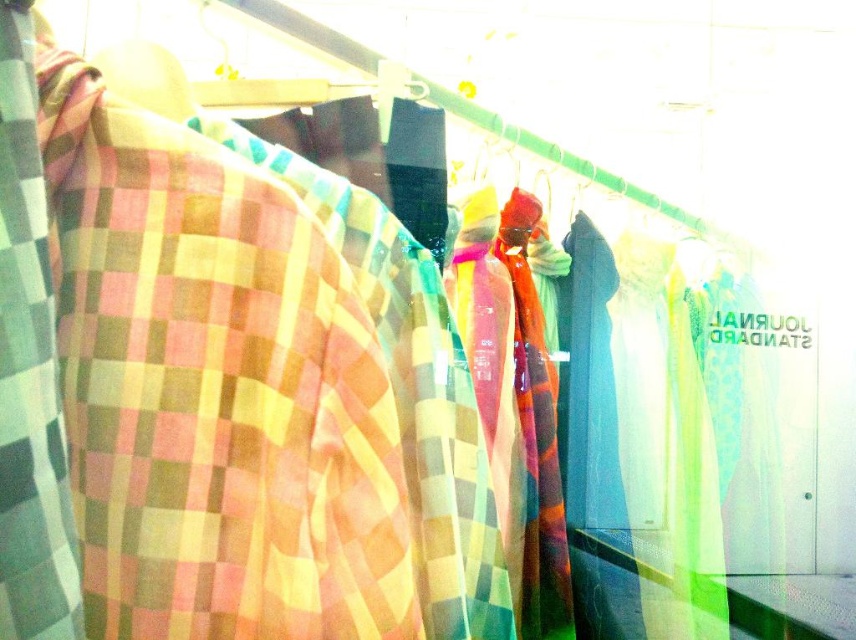
Locate an element on the screen. The width and height of the screenshot is (856, 640). checkered fabric shirt at center is located at coordinates (412, 392).

Which is behind, point (382, 269) or point (40, 186)?

Positioned behind is point (382, 269).

The width and height of the screenshot is (856, 640). Identify the location of checkered fabric shirt at center. (412, 392).

Who is positioned more to the left, checkered fabric shirt at left or translucent multicolored scarf at center?

Positioned to the left is checkered fabric shirt at left.

Is checkered fabric shirt at left below translucent multicolored scarf at center?

Incorrect, checkered fabric shirt at left is not positioned below translucent multicolored scarf at center.

This screenshot has width=856, height=640. Describe the element at coordinates (214, 388) in the screenshot. I see `checkered fabric shirt at left` at that location.

Locate an element on the screen. checkered fabric shirt at left is located at coordinates (214, 388).

Which of these two, checkered fabric at left or translucent multicolored scarf at center, stands taller?

Standing taller between the two is translucent multicolored scarf at center.

Does point (0, 179) come in front of point (490, 403)?

Yes, it is in front of point (490, 403).

Image resolution: width=856 pixels, height=640 pixels. Identify the location of checkered fabric at left. (28, 371).